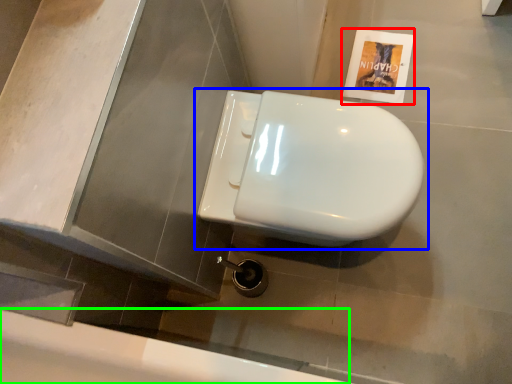
Question: Which is farther away from flyer (highlighted by a red box)? toilet (highlighted by a blue box) or bath (highlighted by a green box)?

Choices:
 (A) toilet
 (B) bath

Answer: (B)